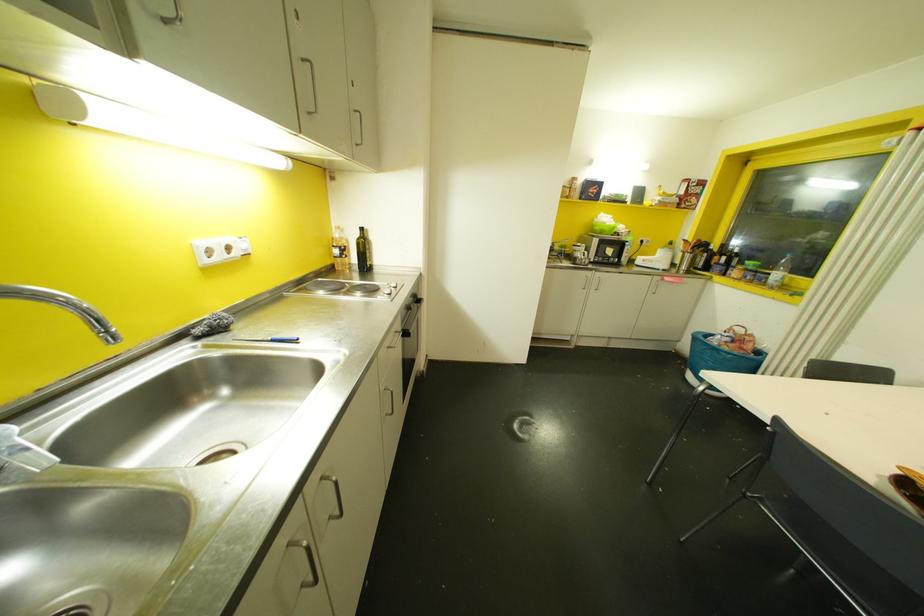
Identify the location of oven door handle. The width and height of the screenshot is (924, 616). (410, 317).